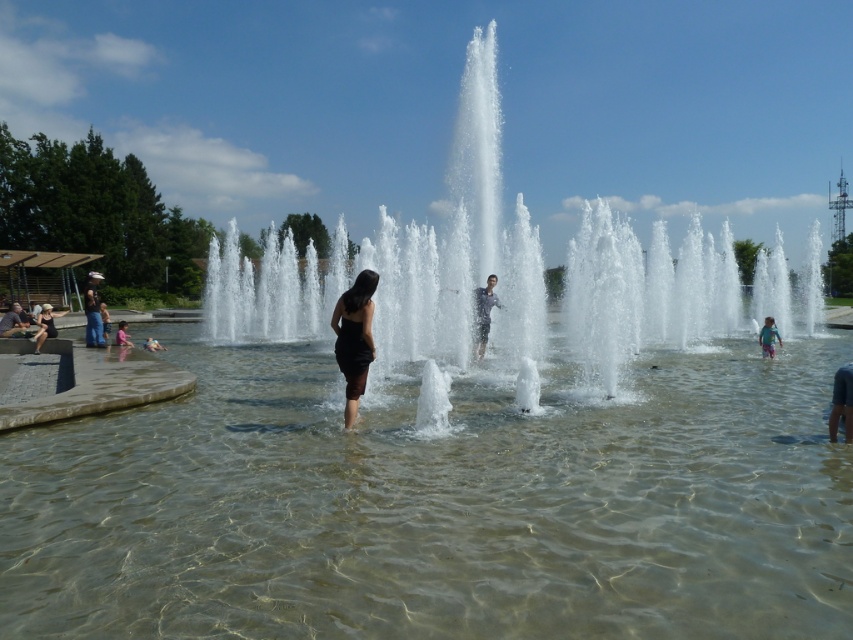
Question: Is clear water at center thinner than clear water fountain at center?

Choices:
 (A) yes
 (B) no

Answer: (A)

Question: Is clear water at center thinner than matte black dress at lower left?

Choices:
 (A) yes
 (B) no

Answer: (B)

Question: Does smooth gray shirt at center come behind pink fabric child at lower left?

Choices:
 (A) yes
 (B) no

Answer: (B)

Question: Which of the following is the closest to the observer?

Choices:
 (A) (759, 387)
 (B) (479, 342)
 (C) (126, 336)

Answer: (A)

Question: Estimate the real-world distances between objects in this image. Which object is closer to the clear water fountain at center?

Choices:
 (A) matte black dress at lower left
 (B) pink fabric child at lower left

Answer: (A)

Question: Which of the following is the closest to the observer?

Choices:
 (A) (42, 320)
 (B) (129, 346)
 (C) (759, 342)
 (D) (238, 67)

Answer: (C)